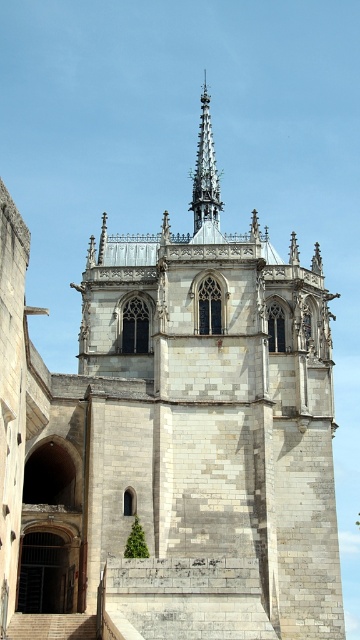
You are standing at the base of the cathedral and want to reach the gray stone spire at upper center. Which direction should you move relative to the smooth stone stairs at lower left?

The gray stone spire at upper center is to the right of the smooth stone stairs at lower left, so you should move to the right relative to the smooth stone stairs at lower left to reach it.

In the scene shown: You are an architect designing a model of the cathedral. The spire must be narrower than the stairs in your model to match the original. Given that the smooth stone stairs at lower left in the model are 10 cm wide, what should be the maximum width of the gray stone spire at upper center in centimeters?

The gray stone spire at upper center is narrower than the smooth stone stairs at lower left. Since the stairs are 10 cm wide in the model, the spire must be less than 10 cm wide. The maximum width should be just under 10 cm, so 9.9 cm would be appropriate.